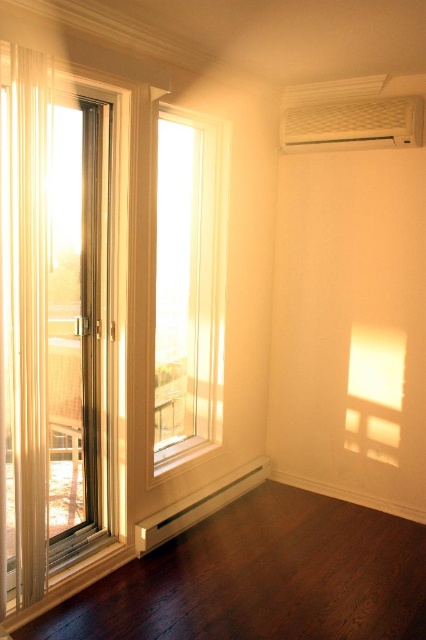
Between point (81, 237) and point (348, 580), which one is positioned behind?

The point (348, 580) is more distant.

Is clear glass screen door at left closer to the viewer compared to dark brown wood at lower left?

Yes, clear glass screen door at left is closer to the viewer.

Identify the location of clear glass screen door at left. (55, 336).

Does point (63, 541) come behind point (175, 312)?

No, it is in front of (175, 312).

Is point (74, 397) in front of point (207, 328)?

Yes, point (74, 397) is in front of point (207, 328).

Is point (108, 346) closer to camera compared to point (184, 451)?

Yes, it is.

In order to click on clear glass screen door at left in this screenshot , I will do `click(55, 336)`.

Between dark brown wood at lower left and clear glass window at center, which one has more height?

clear glass window at center

Is dark brown wood at lower left wider than clear glass window at center?

Yes, dark brown wood at lower left is wider than clear glass window at center.

The height and width of the screenshot is (640, 426). Describe the element at coordinates (261, 579) in the screenshot. I see `dark brown wood at lower left` at that location.

This screenshot has width=426, height=640. In order to click on dark brown wood at lower left in this screenshot , I will do `click(261, 579)`.